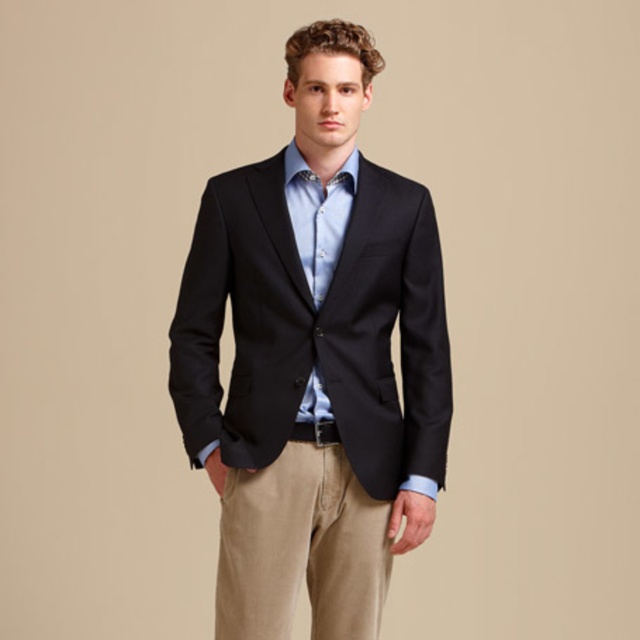
Does point (218, 412) come closer to viewer compared to point (221, 518)?

No, (218, 412) is behind (221, 518).

Between point (275, 401) and point (250, 556), which one is positioned behind?

The point (250, 556) is behind.

Which is in front, point (276, 371) or point (209, 458)?

Point (276, 371) is more forward.

Locate an element on the screen. matte black blazer at center is located at coordinates (314, 358).

Who is more forward, (301, 556) or (300, 221)?

Point (300, 221)

Does khaki cotton pants at lower center appear over light blue cotton shirt at center?

Incorrect, khaki cotton pants at lower center is not positioned above light blue cotton shirt at center.

What do you see at coordinates (300, 547) in the screenshot? I see `khaki cotton pants at lower center` at bounding box center [300, 547].

Where is `khaki cotton pants at lower center`? This screenshot has height=640, width=640. khaki cotton pants at lower center is located at coordinates (300, 547).

Locate an element on the screen. matte black blazer at center is located at coordinates (314, 358).

Who is more forward, (429,525) or (317,177)?

Point (317,177)

At what (x,y) coordinates should I click in order to perform the action: click on matte black blazer at center. Please return your answer as a coordinate pair (x, y). The image size is (640, 640). Looking at the image, I should click on (314, 358).